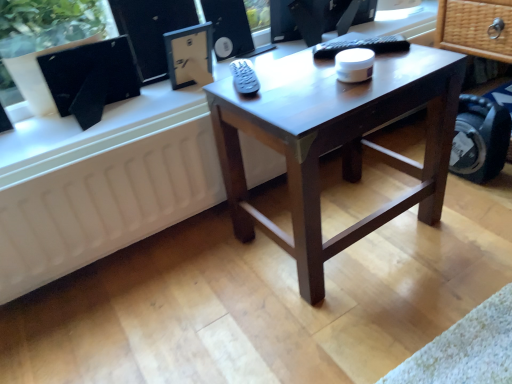
You are a GUI agent. You are given a task and a screenshot of the screen. Output one action in this format:
    pyautogui.click(x=<x>, y=<y>)
    Task: Click on the vacant space underneath matte dark brown coffee table at center (from a real-world perspective)
    Image resolution: width=512 pixels, height=384 pixels.
    Given the screenshot: What is the action you would take?
    pyautogui.click(x=350, y=219)